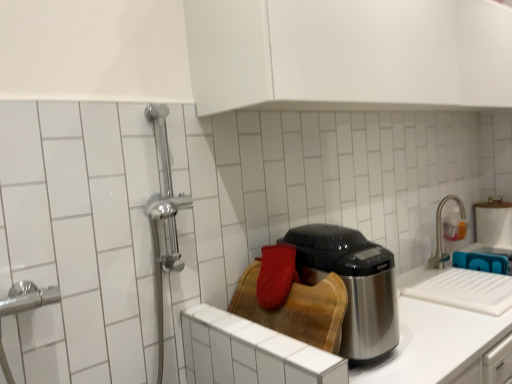
Question: From the image's perspective, is shiny metallic appliance at center beneath satin nickel faucet at upper right?

Choices:
 (A) no
 (B) yes

Answer: (B)

Question: From the image's perspective, is shiny metallic appliance at center above satin nickel faucet at upper right?

Choices:
 (A) yes
 (B) no

Answer: (B)

Question: Can you confirm if shiny metallic appliance at center is smaller than satin nickel faucet at upper right?

Choices:
 (A) no
 (B) yes

Answer: (A)

Question: Is shiny metallic appliance at center looking in the opposite direction of satin nickel faucet at upper right?

Choices:
 (A) no
 (B) yes

Answer: (A)

Question: Can you confirm if shiny metallic appliance at center is shorter than satin nickel faucet at upper right?

Choices:
 (A) no
 (B) yes

Answer: (A)

Question: From the image's perspective, relative to satin steel counter top at center, is shiny metallic appliance at center above or below?

Choices:
 (A) below
 (B) above

Answer: (B)

Question: Considering their positions, is shiny metallic appliance at center located in front of or behind satin steel counter top at center?

Choices:
 (A) behind
 (B) front

Answer: (B)

Question: Is shiny metallic appliance at center inside or outside of satin steel counter top at center?

Choices:
 (A) inside
 (B) outside

Answer: (B)

Question: Is shiny metallic appliance at center bigger or smaller than satin steel counter top at center?

Choices:
 (A) big
 (B) small

Answer: (B)

Question: Considering the relative positions of shiny metallic appliance at center and satin nickel faucet at upper right in the image provided, is shiny metallic appliance at center to the left or to the right of satin nickel faucet at upper right?

Choices:
 (A) left
 (B) right

Answer: (A)

Question: Is point (367, 279) closer or farther from the camera than point (458, 198)?

Choices:
 (A) farther
 (B) closer

Answer: (B)

Question: From a real-world perspective, relative to satin nickel faucet at upper right, is shiny metallic appliance at center vertically above or below?

Choices:
 (A) above
 (B) below

Answer: (A)

Question: Is shiny metallic appliance at center bigger or smaller than satin nickel faucet at upper right?

Choices:
 (A) small
 (B) big

Answer: (B)

Question: Do you think wooden cutting board at center is within satin nickel faucet at upper right, or outside of it?

Choices:
 (A) inside
 (B) outside

Answer: (B)

Question: From the image's perspective, is wooden cutting board at center positioned above or below satin nickel faucet at upper right?

Choices:
 (A) above
 (B) below

Answer: (B)